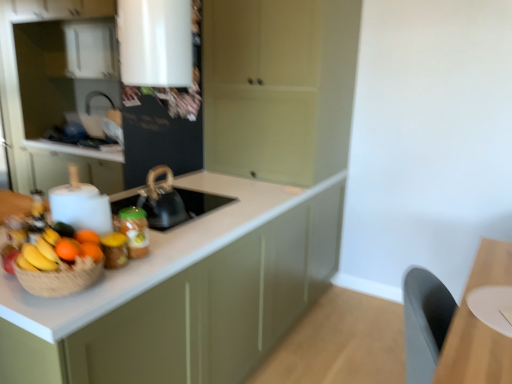
This screenshot has height=384, width=512. In order to click on vacant space in front of translucent glass jar at center in this screenshot , I will do `click(132, 274)`.